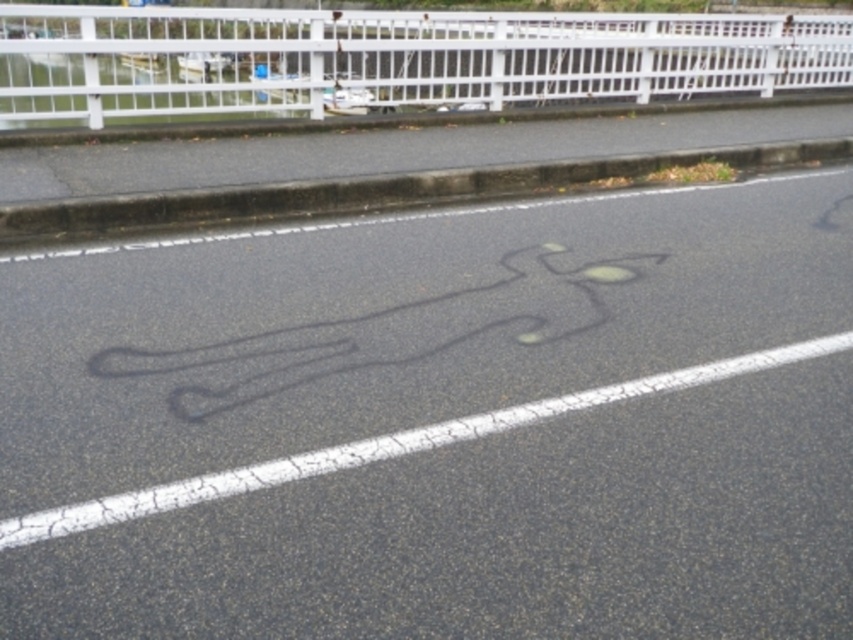
What do you see at coordinates (440, 422) in the screenshot?
I see `black asphalt bike lane at center` at bounding box center [440, 422].

Does black asphalt bike lane at center appear over white painted metal fence at upper center?

No, black asphalt bike lane at center is not above white painted metal fence at upper center.

Find the location of a particular element. black asphalt bike lane at center is located at coordinates point(440,422).

Find the location of a particular element. black asphalt bike lane at center is located at coordinates (440, 422).

Which is below, black asphalt bike lane at center or black asphalt curb at upper center?

black asphalt bike lane at center

Between black asphalt bike lane at center and black asphalt curb at upper center, which one appears on the left side from the viewer's perspective?

From the viewer's perspective, black asphalt curb at upper center appears more on the left side.

In order to click on black asphalt bike lane at center in this screenshot , I will do `click(440, 422)`.

Is point (38, 100) farther from camera compared to point (451, 184)?

Yes, point (38, 100) is behind point (451, 184).

Between white painted metal fence at upper center and black asphalt curb at upper center, which one is positioned lower?

black asphalt curb at upper center is below.

Is point (189, 81) in front of point (270, 193)?

No.

Find the location of a particular element. white painted metal fence at upper center is located at coordinates (392, 58).